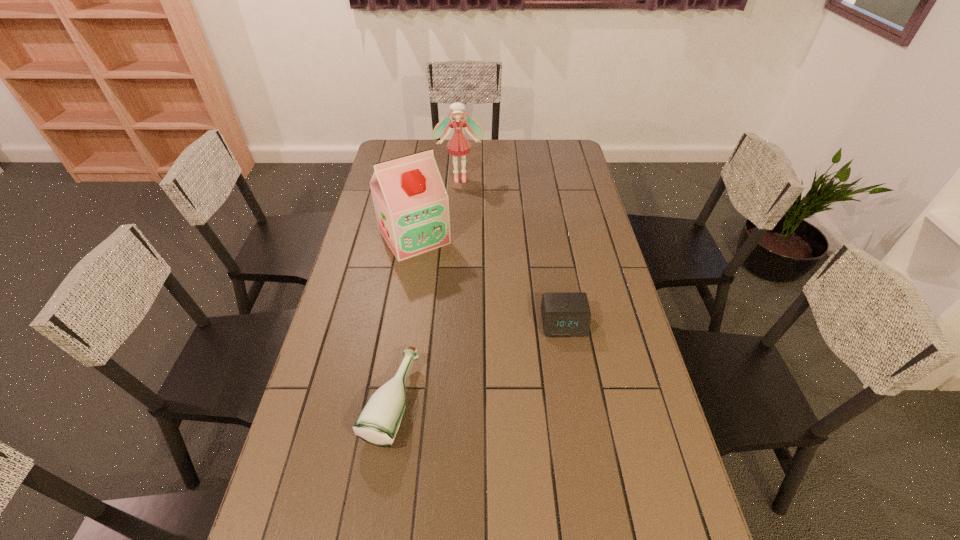
At what (x,y) coordinates should I click in order to perform the action: click on vacant region between the alarm clock and the doll. Please return your answer as a coordinate pair (x, y). Looking at the image, I should click on (512, 251).

Select which object appears as the third closest to the soya milk. Please provide its 2D coordinates. Your answer should be formatted as a tuple, i.e. [(x, y)], where the tuple contains the x and y coordinates of a point satisfying the conditions above.

[(378, 423)]

Locate which object is the closest to the second farthest object. Please provide its 2D coordinates. Your answer should be formatted as a tuple, i.e. [(x, y)], where the tuple contains the x and y coordinates of a point satisfying the conditions above.

[(458, 145)]